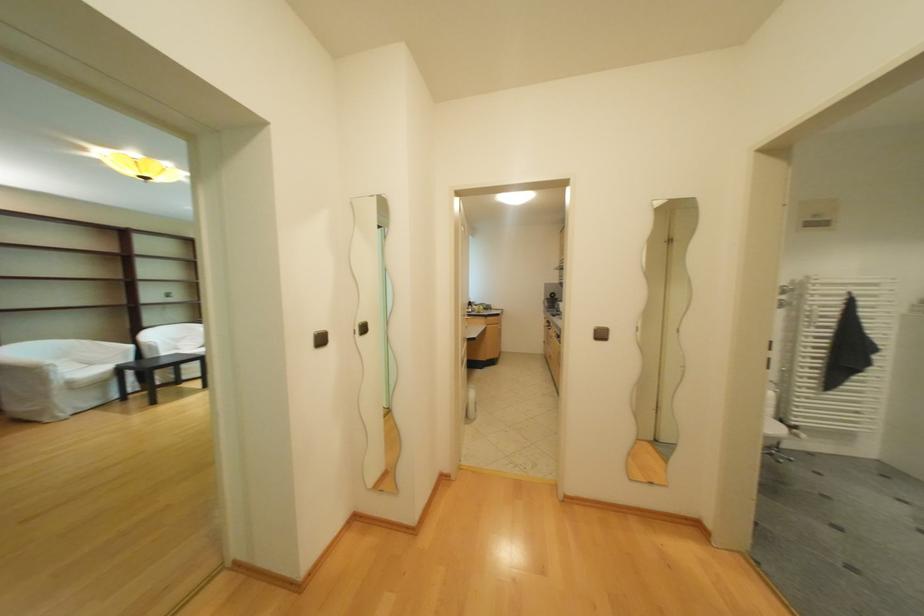
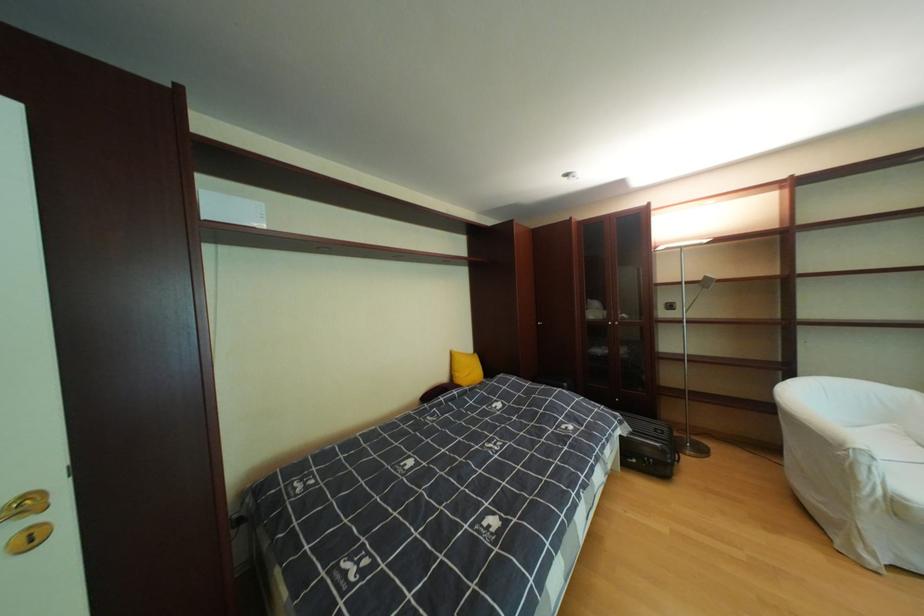
The point at (x=82, y=384) is marked in the first image. Where is the corresponding point in the second image?

(908, 506)